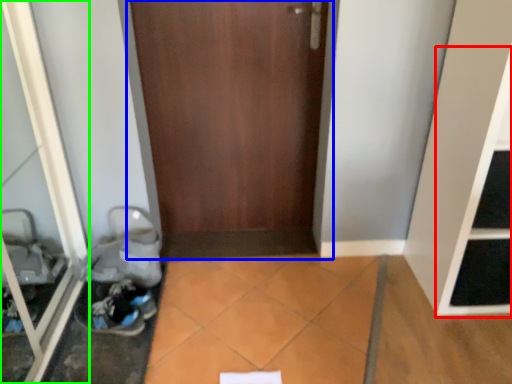
Question: Based on their relative distances, which object is farther from shelf (highlighted by a red box)? Choose from door (highlighted by a blue box) and glass door (highlighted by a green box).

Choices:
 (A) door
 (B) glass door

Answer: (B)